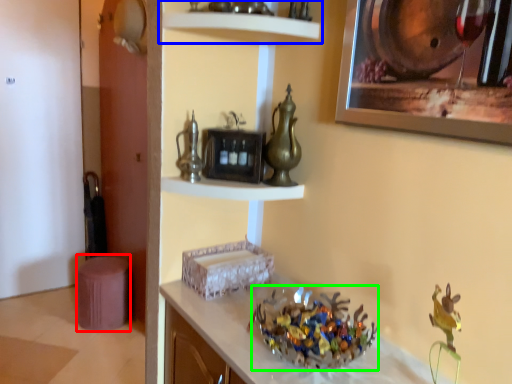
Question: Estimate the real-world distances between objects in this image. Which object is farther from stool (highlighted by a red box), shelf (highlighted by a blue box) or collection (highlighted by a green box)?

Choices:
 (A) shelf
 (B) collection

Answer: (A)